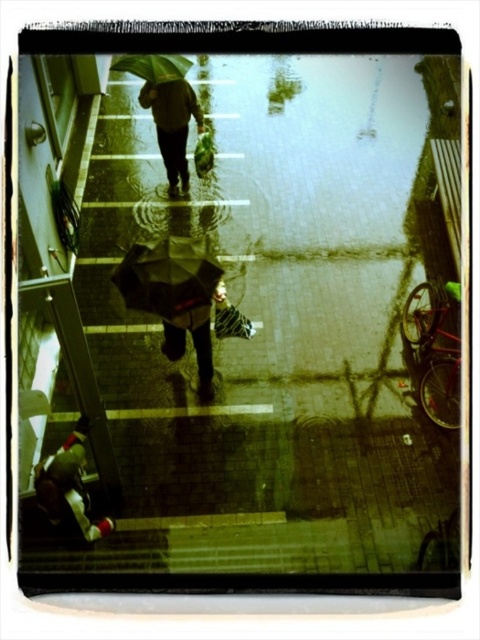
Based on the photo, who is more forward, (x=156, y=248) or (x=71, y=529)?

Point (x=71, y=529) is more forward.

In the scene shown: Does transparent plastic umbrella at center have a larger size compared to red fabric bag at lower left?

Yes.

Is point (195, 317) positioned before point (76, 529)?

No, it is not.

You are a GUI agent. You are given a task and a screenshot of the screen. Output one action in this format:
    pyautogui.click(x=<x>, y=<y>)
    Task: Click on the transparent plastic umbrella at center
    Image resolution: width=480 pixels, height=640 pixels.
    Given the screenshot: What is the action you would take?
    pyautogui.click(x=169, y=280)

Between matte black umbrella at upper center and green matte umbrella at upper center, which one has less height?

green matte umbrella at upper center is shorter.

Who is more distant from viewer, (179, 84) or (145, 76)?

Point (179, 84)

Is point (145, 93) in front of point (140, 64)?

No.

This screenshot has height=640, width=480. Identify the location of matte black umbrella at upper center. (172, 124).

Between red fabric bag at lower left and matte black umbrella at upper center, which one appears on the left side from the viewer's perspective?

red fabric bag at lower left

I want to click on red fabric bag at lower left, so click(x=69, y=486).